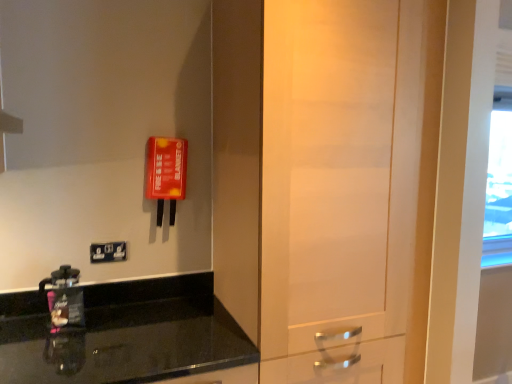
Locate an element on the screen. black granite countertop at lower left is located at coordinates (125, 335).

Image resolution: width=512 pixels, height=384 pixels. Find the location of `black plastic/light switch at lower left`. black plastic/light switch at lower left is located at coordinates (108, 252).

Based on the photo, does matte wood door at center contain black granite countertop at lower left?

No, black granite countertop at lower left is not inside matte wood door at center.

Considering the sizes of matte wood door at center and black granite countertop at lower left in the image, is matte wood door at center taller or shorter than black granite countertop at lower left?

Clearly, matte wood door at center is taller compared to black granite countertop at lower left.

Is matte wood door at center oriented towards black granite countertop at lower left?

No, matte wood door at center does not turn towards black granite countertop at lower left.

Considering the sizes of matte wood door at center and black granite countertop at lower left in the image, is matte wood door at center bigger or smaller than black granite countertop at lower left?

matte wood door at center is bigger than black granite countertop at lower left.

Is black plastic/light switch at lower left wider or thinner than black granite countertop at lower left?

black plastic/light switch at lower left is thinner than black granite countertop at lower left.

The image size is (512, 384). Find the location of `light switch behind the black granite countertop at lower left`. light switch behind the black granite countertop at lower left is located at coordinates (108, 252).

Can you tell me how much black plastic/light switch at lower left and black granite countertop at lower left differ in facing direction?

There is a 1.48-degree angle between the facing directions of black plastic/light switch at lower left and black granite countertop at lower left.

Based on the photo, relative to black granite countertop at lower left, is black plastic/light switch at lower left in front or behind?

Visually, black plastic/light switch at lower left is located behind black granite countertop at lower left.

Is black plastic/light switch at lower left placed right next to matte black coffee maker at lower left?

black plastic/light switch at lower left and matte black coffee maker at lower left are clearly separated.

In terms of width, does black plastic/light switch at lower left look wider or thinner when compared to matte black coffee maker at lower left?

black plastic/light switch at lower left is thinner than matte black coffee maker at lower left.

Is black plastic/light switch at lower left completely or partially outside of matte black coffee maker at lower left?

black plastic/light switch at lower left lies outside matte black coffee maker at lower left's area.

How distant is black plastic/light switch at lower left from matte black coffee maker at lower left?

black plastic/light switch at lower left and matte black coffee maker at lower left are 7.87 inches apart.

Which is more to the left, matte wood door at center or black plastic/light switch at lower left?

black plastic/light switch at lower left.

Looking at this image, in terms of width, does matte wood door at center look wider or thinner when compared to black plastic/light switch at lower left?

matte wood door at center is wider than black plastic/light switch at lower left.

Do you think matte wood door at center is within black plastic/light switch at lower left, or outside of it?

matte wood door at center cannot be found inside black plastic/light switch at lower left.

You are a GUI agent. You are given a task and a screenshot of the screen. Output one action in this format:
    pyautogui.click(x=<x>, y=<y>)
    Task: Click on the door located above the black granite countertop at lower left (from the image's perspective)
    
    Given the screenshot: What is the action you would take?
    click(326, 179)

Can you tell me how much black granite countertop at lower left and matte wood door at center differ in facing direction?

There is a 0.312-degree angle between the facing directions of black granite countertop at lower left and matte wood door at center.

Is black granite countertop at lower left positioned far away from matte wood door at center?

No, black granite countertop at lower left is in close proximity to matte wood door at center.

Which object is further away from the camera taking this photo, black granite countertop at lower left or matte wood door at center?

matte wood door at center is behind.

Would you say black granite countertop at lower left is inside or outside matte black coffee maker at lower left?

The correct answer is: outside.

Can you confirm if black granite countertop at lower left is wider than matte black coffee maker at lower left?

Yes.

Is black granite countertop at lower left closer to the viewer compared to matte black coffee maker at lower left?

Yes, black granite countertop at lower left is closer to the viewer.

At what (x,y) coordinates should I click in order to perform the action: click on appliance on the left side of matte wood door at center. Please return your answer as a coordinate pair (x, y). This screenshot has width=512, height=384. Looking at the image, I should click on (65, 298).

Consider the image. From the image's perspective, is matte wood door at center beneath matte black coffee maker at lower left?

No, from the image's perspective, matte wood door at center is not beneath matte black coffee maker at lower left.

Would you say matte wood door at center is to the left or to the right of matte black coffee maker at lower left in the picture?

Clearly, matte wood door at center is on the right of matte black coffee maker at lower left in the image.

I want to click on door above the black granite countertop at lower left (from the image's perspective), so click(x=326, y=179).

Where is `countertop on the right of black plastic/light switch at lower left`? The height and width of the screenshot is (384, 512). countertop on the right of black plastic/light switch at lower left is located at coordinates coord(125,335).

From the image, which object appears to be farther from matte black coffee maker at lower left, matte wood door at center or black granite countertop at lower left?

Among the two, matte wood door at center is located further to matte black coffee maker at lower left.

Looking at the image, which one is located further to matte black coffee maker at lower left, black plastic/light switch at lower left or matte wood door at center?

matte wood door at center is positioned further to the anchor matte black coffee maker at lower left.

Considering their positions, is matte wood door at center positioned further to black granite countertop at lower left than matte black coffee maker at lower left?

The object further to black granite countertop at lower left is matte wood door at center.

Considering their positions, is matte wood door at center positioned closer to matte black coffee maker at lower left than black plastic/light switch at lower left?

black plastic/light switch at lower left lies closer to matte black coffee maker at lower left than the other object.

Looking at the image, which one is located further to black plastic/light switch at lower left, black granite countertop at lower left or matte wood door at center?

matte wood door at center is positioned further to the anchor black plastic/light switch at lower left.

From the image, which object appears to be farther from matte black coffee maker at lower left, black granite countertop at lower left or black plastic/light switch at lower left?

Among the two, black granite countertop at lower left is located further to matte black coffee maker at lower left.

When comparing their distances from matte wood door at center, does black granite countertop at lower left or matte black coffee maker at lower left seem closer?

The object closer to matte wood door at center is black granite countertop at lower left.

Looking at this image, considering their positions, is matte black coffee maker at lower left positioned closer to matte wood door at center than black plastic/light switch at lower left?

black plastic/light switch at lower left is closer to matte wood door at center.

At what (x,y) coordinates should I click in order to perform the action: click on countertop between black plastic/light switch at lower left and matte wood door at center from left to right. Please return your answer as a coordinate pair (x, y). Looking at the image, I should click on [125, 335].

I want to click on appliance located between black granite countertop at lower left and black plastic/light switch at lower left in the depth direction, so click(x=65, y=298).

Identify the location of light switch between matte black coffee maker at lower left and matte wood door at center in the horizontal direction. The height and width of the screenshot is (384, 512). (108, 252).

At what (x,y) coordinates should I click in order to perform the action: click on countertop situated between matte black coffee maker at lower left and matte wood door at center from left to right. Please return your answer as a coordinate pair (x, y). This screenshot has width=512, height=384. Looking at the image, I should click on (125, 335).